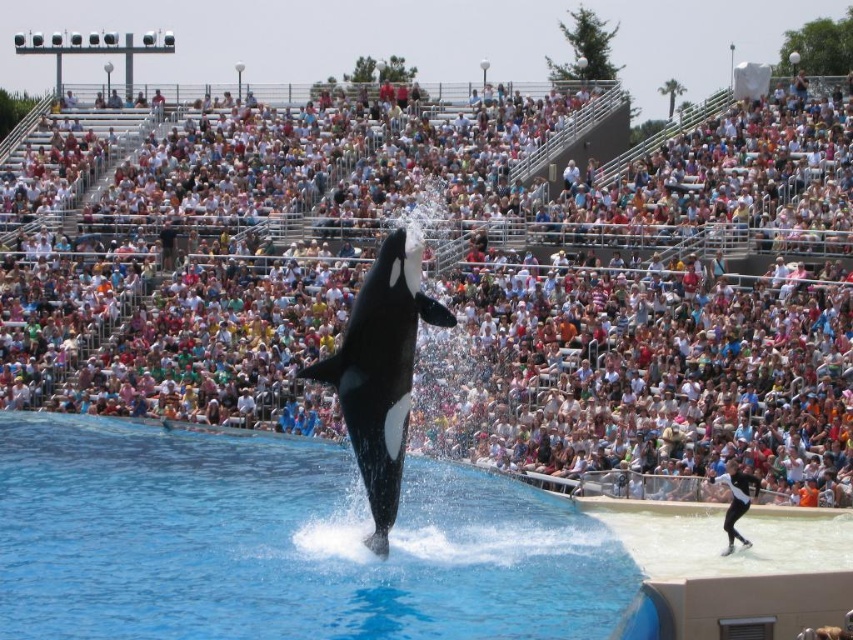
Does clear blue water at center have a lesser width compared to black smooth orca at center?

No.

Does clear blue water at center appear under black smooth orca at center?

Yes.

Image resolution: width=853 pixels, height=640 pixels. What are the coordinates of `clear blue water at center` in the screenshot? It's located at (283, 544).

Is multicolored fabric crowd at upper center to the right of clear blue water at center from the viewer's perspective?

Indeed, multicolored fabric crowd at upper center is positioned on the right side of clear blue water at center.

Does point (578, 356) come behind point (553, 621)?

Yes, point (578, 356) is behind point (553, 621).

Between point (393, 180) and point (229, 618), which one is positioned in front?

Point (229, 618)

At what (x,y) coordinates should I click in order to perform the action: click on multicolored fabric crowd at upper center. Please return your answer as a coordinate pair (x, y). The height and width of the screenshot is (640, 853). Looking at the image, I should click on (473, 288).

Can you confirm if multicolored fabric crowd at upper center is positioned to the left of black smooth orca at center?

In fact, multicolored fabric crowd at upper center is to the right of black smooth orca at center.

Is point (558, 392) farther from viewer compared to point (315, 380)?

Yes, point (558, 392) is farther from viewer.

Between point (479, 362) and point (370, 499), which one is positioned behind?

The point (479, 362) is more distant.

Find the location of a particular element. The height and width of the screenshot is (640, 853). multicolored fabric crowd at upper center is located at coordinates (473, 288).